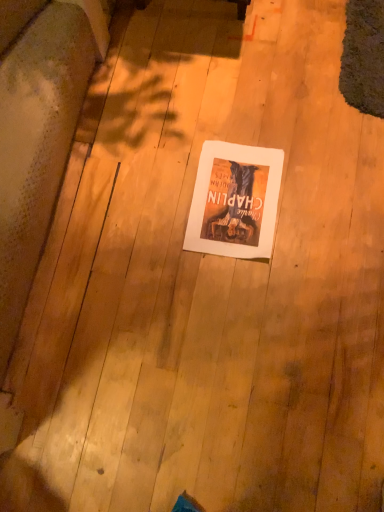
Where is `vacant space to the right of white paper poster at center`? This screenshot has width=384, height=512. vacant space to the right of white paper poster at center is located at coordinates (322, 193).